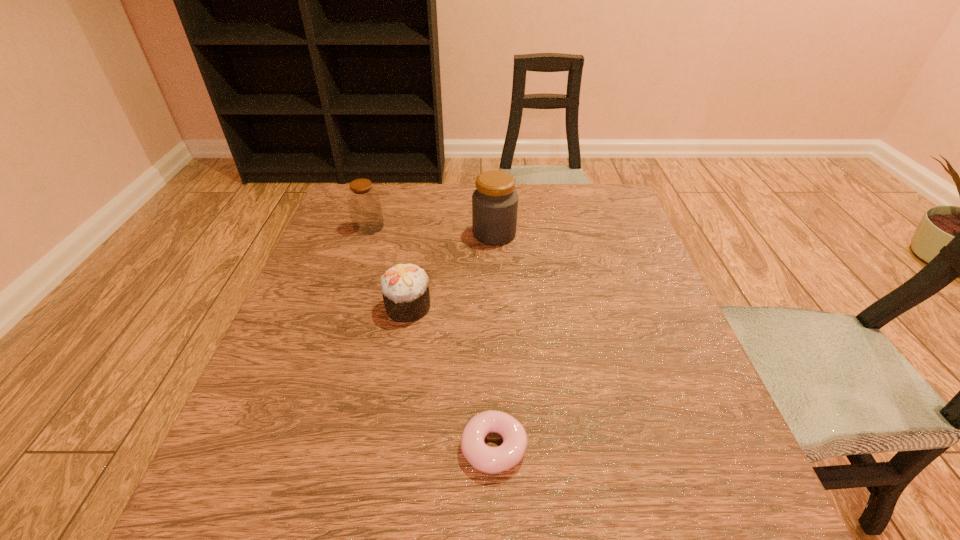
At what (x,y) coordinates should I click in order to perform the action: click on the tallest object. Please return your answer as a coordinate pair (x, y). The width and height of the screenshot is (960, 540). Looking at the image, I should click on (495, 202).

Identify the location of the taller jar. This screenshot has width=960, height=540. (495, 202).

Locate an element on the screen. The image size is (960, 540). the left jar is located at coordinates (363, 200).

Where is `the shorter jar`? The image size is (960, 540). the shorter jar is located at coordinates (363, 200).

Image resolution: width=960 pixels, height=540 pixels. In order to click on the second object from left to right in this screenshot , I will do `click(405, 287)`.

Find the location of a particular element. Image resolution: width=960 pixels, height=540 pixels. cupcake is located at coordinates (405, 287).

The height and width of the screenshot is (540, 960). Identify the location of doughnut. (490, 460).

Locate an element on the screen. the shortest object is located at coordinates (490, 460).

I want to click on vacant area located on the surface of the tallest object near the warning symbol, so click(x=422, y=234).

Identify the location of vacant space located 0.350m on the surface of the tallest object near the warning symbol. Image resolution: width=960 pixels, height=540 pixels. (338, 234).